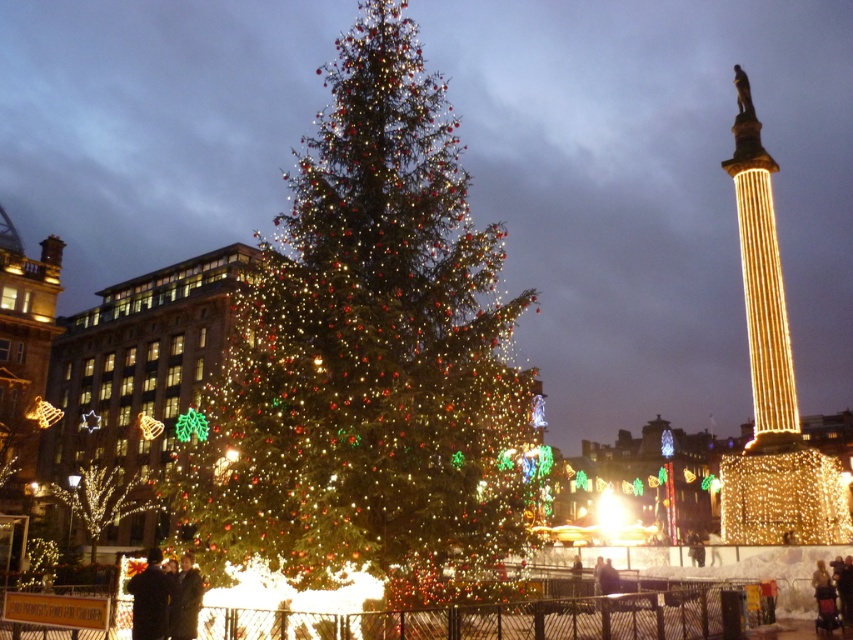
You are standing in the public square and want to take a photo of both the Christmas tree and the illuminated column. You notice two points marked on the ground where you can stand to frame your shot. The first point is at coordinate point (144, 504) and the second is at point (160, 628). Which point will allow you to be closer to the Christmas tree?

Point (144, 504) is further to the viewer than point (160, 628), so standing at point (144, 504) will place you closer to the Christmas tree.

You are standing at the point with coordinates (366, 353) in the festive urban scene. Which object are you currently on?

The point at (366, 353) is on the green matte Christmas tree at center.